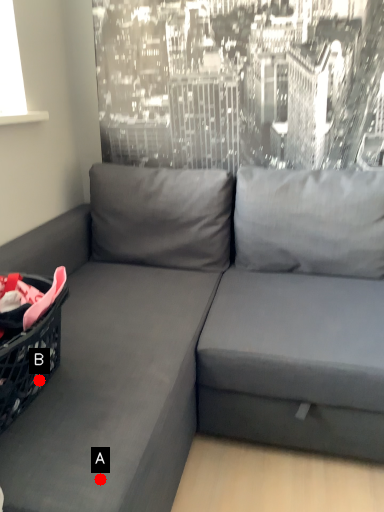
Question: Two points are circled on the image, labeled by A and B beside each circle. Which point is closer to the camera?

Choices:
 (A) A is closer
 (B) B is closer

Answer: (A)